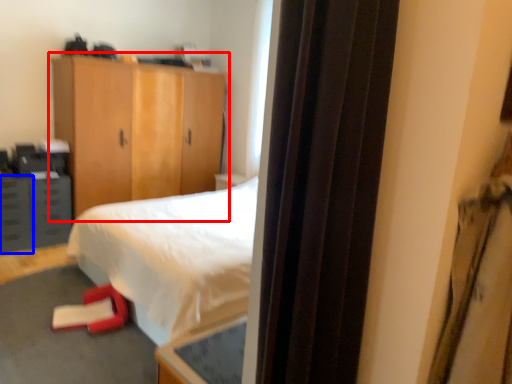
Question: Which object is further to the camera taking this photo, cupboard (highlighted by a red box) or drawer (highlighted by a blue box)?

Choices:
 (A) cupboard
 (B) drawer

Answer: (A)